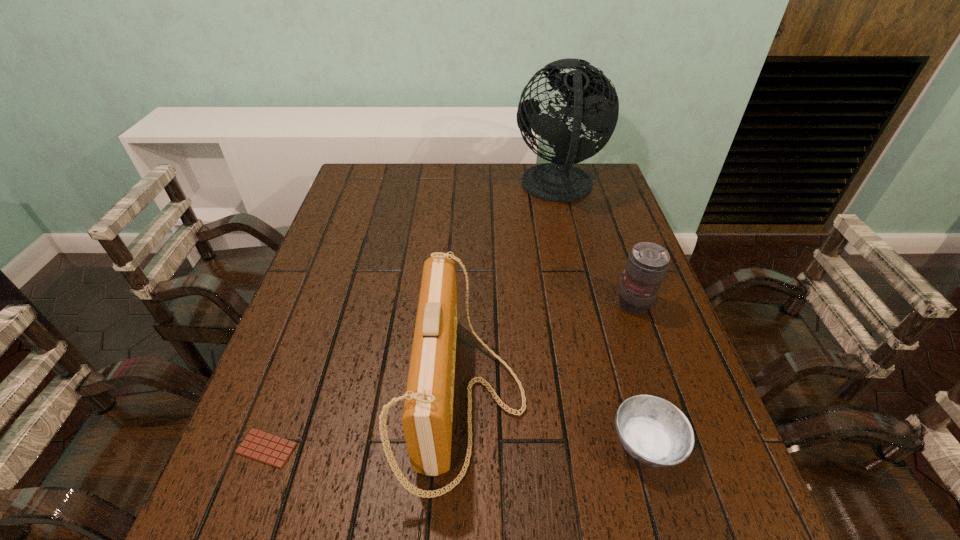
Where is `ashtray located at the right edge`? Image resolution: width=960 pixels, height=540 pixels. ashtray located at the right edge is located at coordinates (652, 430).

Identify the location of object at the far right corner. (595, 103).

Locate an element on the screen. This screenshot has width=960, height=540. free space at the far edge of the desktop is located at coordinates (492, 183).

Find the location of `free location at the near edge`. free location at the near edge is located at coordinates (573, 516).

In the image, there is a desktop. Where is `vacant space at the left edge`? The image size is (960, 540). vacant space at the left edge is located at coordinates (316, 380).

In the image, there is a desktop. At what (x,y) coordinates should I click in order to perform the action: click on vacant space at the right edge. Please return your answer as a coordinate pair (x, y). The image size is (960, 540). Looking at the image, I should click on (627, 220).

Identify the location of vacant region at the far left corner of the desktop. This screenshot has width=960, height=540. (391, 175).

Find the location of a particular element. vacant space that's between the second shortest object and the handbag is located at coordinates (556, 421).

The width and height of the screenshot is (960, 540). Find the location of `vacant area between the leftmost object and the globe`. vacant area between the leftmost object and the globe is located at coordinates (413, 319).

The image size is (960, 540). Find the location of `vacant area that lies between the telephoto lens and the globe`. vacant area that lies between the telephoto lens and the globe is located at coordinates (596, 246).